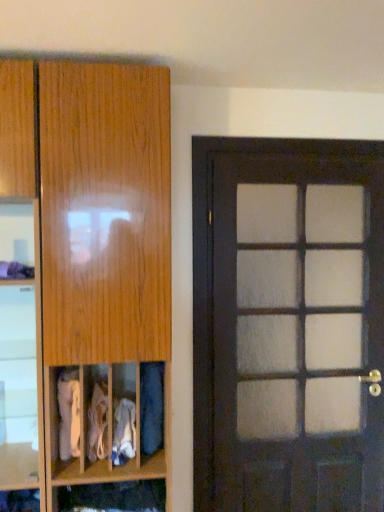
What is the approximate height of white fabric at center, which is the second clothing in right-to-left order?

It is 8.06 inches.

Describe the element at coordinates (123, 431) in the screenshot. I see `white fabric at center, which is the second clothing in right-to-left order` at that location.

Find the location of `white cotton socks at center, which is counted as the second clothing, starting from the left`. white cotton socks at center, which is counted as the second clothing, starting from the left is located at coordinates (98, 422).

The width and height of the screenshot is (384, 512). Find the location of `white fabric at center, which is the second clothing in right-to-left order`. white fabric at center, which is the second clothing in right-to-left order is located at coordinates (123, 431).

Find the location of `cabinet located underneath the dark wood door at right (from a real-world perspective)`. cabinet located underneath the dark wood door at right (from a real-world perspective) is located at coordinates (114, 496).

Could you tell me if dark wood door at right is facing wooden cabinet at lower center?

No.

In the scene shown: From the image's perspective, which one is positioned lower, dark wood door at right or wooden cabinet at lower center?

wooden cabinet at lower center, from the image's perspective.

Between dark wood door at right and wooden cabinet at lower center, which one has smaller width?

With smaller width is dark wood door at right.

From a real-world perspective, who is located higher, white fabric at center, which is the second clothing in right-to-left order, or wooden cabinet at left?

In real-world perspective, wooden cabinet at left is above.

The height and width of the screenshot is (512, 384). Identify the location of cabinetry that appears above the white fabric at center, which is the second clothing in right-to-left order (from a real-world perspective). (104, 241).

Based on the photo, how different are the orientations of white fabric at center, arranged as the 3th clothing when viewed from the left, and wooden cabinet at left in degrees?

0.00176 degrees separate the facing orientations of white fabric at center, arranged as the 3th clothing when viewed from the left, and wooden cabinet at left.

Could you tell me if white fabric at center, which is the second clothing in right-to-left order, is turned towards wooden cabinet at left?

Yes, white fabric at center, which is the second clothing in right-to-left order, is turned towards wooden cabinet at left.

Considering the points (67, 441) and (104, 442), which point is behind, point (67, 441) or point (104, 442)?

The point (104, 442) is more distant.

How far apart are white fabric at lower left, which is the 4th clothing from right to left, and white cotton socks at center, which is counted as the second clothing, starting from the left?

A distance of 3.76 inches exists between white fabric at lower left, which is the 4th clothing from right to left, and white cotton socks at center, which is counted as the second clothing, starting from the left.

From the image's perspective, relative to white cotton socks at center, positioned as the 3th clothing in right-to-left order, is white fabric at lower left, placed as the 1th clothing when sorted from left to right, above or below?

white fabric at lower left, placed as the 1th clothing when sorted from left to right, is above white cotton socks at center, positioned as the 3th clothing in right-to-left order.

Does white fabric at lower left, which is the 4th clothing from right to left, appear on the right side of white cotton socks at center, which is counted as the second clothing, starting from the left?

No, white fabric at lower left, which is the 4th clothing from right to left, is not to the right of white cotton socks at center, which is counted as the second clothing, starting from the left.

From a real-world perspective, who is located lower, wooden cabinet at left or wooden cabinet at lower center?

wooden cabinet at lower center, from a real-world perspective.

Can you tell me how much wooden cabinet at left and wooden cabinet at lower center differ in facing direction?

The facing directions of wooden cabinet at left and wooden cabinet at lower center are 0.000831 degrees apart.

Is the position of wooden cabinet at left more distant than that of wooden cabinet at lower center?

That is False.

Looking at this image, which of these two, white fabric at lower left, placed as the 1th clothing when sorted from left to right, or wooden cabinet at lower center, stands shorter?

wooden cabinet at lower center is shorter.

Considering the sizes of objects white fabric at lower left, placed as the 1th clothing when sorted from left to right, and wooden cabinet at lower center in the image provided, who is thinner, white fabric at lower left, placed as the 1th clothing when sorted from left to right, or wooden cabinet at lower center?

Thinner between the two is wooden cabinet at lower center.

How distant is white fabric at lower left, which is the 4th clothing from right to left, from wooden cabinet at lower center?

white fabric at lower left, which is the 4th clothing from right to left, is 10.05 inches away from wooden cabinet at lower center.

Between white fabric at lower left, placed as the 1th clothing when sorted from left to right, and wooden cabinet at lower center, which one has smaller size?

With smaller size is wooden cabinet at lower center.

Which is in front, point (358, 451) or point (151, 384)?

The point (151, 384) is closer.

Is dark wood door at right to the left of blue fabric at lower left, the 4th clothing when ordered from left to right, from the viewer's perspective?

Incorrect, dark wood door at right is not on the left side of blue fabric at lower left, the 4th clothing when ordered from left to right.

Which object is closer to the camera taking this photo, dark wood door at right or blue fabric at lower left, the first clothing viewed from the right?

Positioned in front is blue fabric at lower left, the first clothing viewed from the right.

How different are the orientations of white cotton socks at center, which is counted as the second clothing, starting from the left, and blue fabric at lower left, the 4th clothing when ordered from left to right, in degrees?

The angular difference between white cotton socks at center, which is counted as the second clothing, starting from the left, and blue fabric at lower left, the 4th clothing when ordered from left to right, is 0.0031 degrees.

Is white cotton socks at center, positioned as the 3th clothing in right-to-left order, positioned with its back to blue fabric at lower left, the 4th clothing when ordered from left to right?

No.

Identify the location of the 2nd clothing directly above the white cotton socks at center, which is counted as the second clothing, starting from the left (from a real-world perspective). Image resolution: width=384 pixels, height=512 pixels. (151, 407).

Considering the sizes of objects white cotton socks at center, which is counted as the second clothing, starting from the left, and blue fabric at lower left, the first clothing viewed from the right, in the image provided, who is bigger, white cotton socks at center, which is counted as the second clothing, starting from the left, or blue fabric at lower left, the first clothing viewed from the right,?

With larger size is white cotton socks at center, which is counted as the second clothing, starting from the left.

Where is `door above the wooden cabinet at lower center (from a real-world perspective)`? Image resolution: width=384 pixels, height=512 pixels. door above the wooden cabinet at lower center (from a real-world perspective) is located at coordinates (288, 325).

Locate an element on the screen. Image resolution: width=384 pixels, height=512 pixels. cabinetry in front of the white fabric at center, which is the second clothing in right-to-left order is located at coordinates (104, 241).

Looking at the image, which one is located closer to white cotton socks at center, which is counted as the second clothing, starting from the left, wooden cabinet at lower center or white fabric at center, which is the second clothing in right-to-left order?

Among the two, white fabric at center, which is the second clothing in right-to-left order, is located nearer to white cotton socks at center, which is counted as the second clothing, starting from the left.

Considering their positions, is white fabric at center, arranged as the 3th clothing when viewed from the left, positioned closer to blue fabric at lower left, the 4th clothing when ordered from left to right, than wooden cabinet at left?

The object closer to blue fabric at lower left, the 4th clothing when ordered from left to right, is white fabric at center, arranged as the 3th clothing when viewed from the left.

When comparing their distances from white fabric at center, which is the second clothing in right-to-left order, does white fabric at lower left, placed as the 1th clothing when sorted from left to right, or wooden cabinet at lower center seem closer?

white fabric at lower left, placed as the 1th clothing when sorted from left to right, lies closer to white fabric at center, which is the second clothing in right-to-left order, than the other object.

Consider the image. Based on their spatial positions, is blue fabric at lower left, the first clothing viewed from the right, or dark wood door at right closer to wooden cabinet at left?

Based on the image, blue fabric at lower left, the first clothing viewed from the right, appears to be nearer to wooden cabinet at left.

Considering their positions, is wooden cabinet at lower center positioned further to white fabric at center, arranged as the 3th clothing when viewed from the left, than blue fabric at lower left, the 4th clothing when ordered from left to right?

wooden cabinet at lower center.

Looking at the image, which one is located closer to wooden cabinet at lower center, dark wood door at right or white fabric at center, arranged as the 3th clothing when viewed from the left?

white fabric at center, arranged as the 3th clothing when viewed from the left, is positioned closer to the anchor wooden cabinet at lower center.

Estimate the real-world distances between objects in this image. Which object is closer to wooden cabinet at lower center, white cotton socks at center, positioned as the 3th clothing in right-to-left order, or blue fabric at lower left, the 4th clothing when ordered from left to right?

The object closer to wooden cabinet at lower center is white cotton socks at center, positioned as the 3th clothing in right-to-left order.

Which object lies nearer to the anchor point wooden cabinet at left, dark wood door at right or white fabric at lower left, which is the 4th clothing from right to left?

The object closer to wooden cabinet at left is white fabric at lower left, which is the 4th clothing from right to left.

The height and width of the screenshot is (512, 384). Identify the location of cabinet between white cotton socks at center, positioned as the 3th clothing in right-to-left order, and dark wood door at right. (114, 496).

Locate an element on the screen. clothing between white fabric at lower left, placed as the 1th clothing when sorted from left to right, and white fabric at center, arranged as the 3th clothing when viewed from the left is located at coordinates (98, 422).

Where is `clothing that lies between white cotton socks at center, positioned as the 3th clothing in right-to-left order, and wooden cabinet at lower center from top to bottom`? This screenshot has width=384, height=512. clothing that lies between white cotton socks at center, positioned as the 3th clothing in right-to-left order, and wooden cabinet at lower center from top to bottom is located at coordinates (123, 431).

This screenshot has height=512, width=384. I want to click on clothing situated between white cotton socks at center, positioned as the 3th clothing in right-to-left order, and blue fabric at lower left, the 4th clothing when ordered from left to right, from left to right, so click(123, 431).